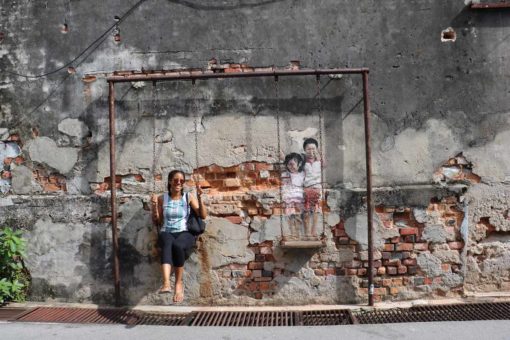
Where is `cement wall`? The image size is (510, 340). cement wall is located at coordinates (418, 105).